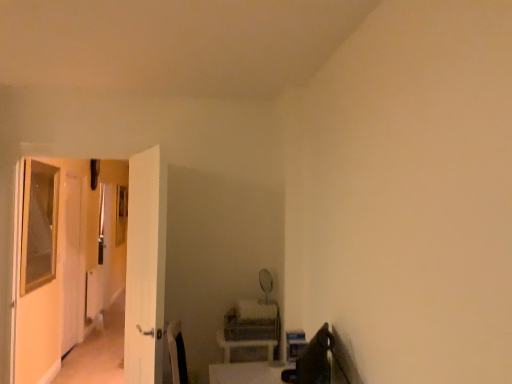
Question: Is white glossy door at left, placed as the first screen door when sorted from front to back, turned away from green fabric swivel chair at lower right?

Choices:
 (A) no
 (B) yes

Answer: (A)

Question: From the image's perspective, is white glossy door at left, marked as the 2th screen door in a left-to-right arrangement, over green fabric swivel chair at lower right?

Choices:
 (A) no
 (B) yes

Answer: (B)

Question: Considering the relative sizes of white glossy door at left, placed as the first screen door when sorted from front to back, and green fabric swivel chair at lower right in the image provided, is white glossy door at left, placed as the first screen door when sorted from front to back, shorter than green fabric swivel chair at lower right?

Choices:
 (A) yes
 (B) no

Answer: (B)

Question: Is white glossy door at left, which is the second screen door in back-to-front order, at the left side of green fabric swivel chair at lower right?

Choices:
 (A) yes
 (B) no

Answer: (A)

Question: From a real-world perspective, is white glossy door at left, which is the second screen door in back-to-front order, on top of green fabric swivel chair at lower right?

Choices:
 (A) yes
 (B) no

Answer: (A)

Question: Considering the relative sizes of white glossy door at left, placed as the first screen door when sorted from front to back, and green fabric swivel chair at lower right in the image provided, is white glossy door at left, placed as the first screen door when sorted from front to back, bigger than green fabric swivel chair at lower right?

Choices:
 (A) yes
 (B) no

Answer: (A)

Question: Is clear glass screen door at left, the 1th screen door positioned from the back, at the left side of green fabric swivel chair at lower right?

Choices:
 (A) yes
 (B) no

Answer: (A)

Question: Is clear glass screen door at left, positioned as the 2th screen door in right-to-left order, next to green fabric swivel chair at lower right?

Choices:
 (A) yes
 (B) no

Answer: (B)

Question: Can you confirm if clear glass screen door at left, which is the 2th screen door in front-to-back order, is shorter than green fabric swivel chair at lower right?

Choices:
 (A) yes
 (B) no

Answer: (B)

Question: From the image's perspective, is clear glass screen door at left, the 1th screen door positioned from the back, located beneath green fabric swivel chair at lower right?

Choices:
 (A) yes
 (B) no

Answer: (B)

Question: Is clear glass screen door at left, the 1th screen door positioned from the back, taller than green fabric swivel chair at lower right?

Choices:
 (A) no
 (B) yes

Answer: (B)

Question: From the image's perspective, is clear glass screen door at left, the 1th screen door positioned from the back, on top of green fabric swivel chair at lower right?

Choices:
 (A) yes
 (B) no

Answer: (A)

Question: Considering the relative positions of green fabric swivel chair at lower right and white glossy door at left, placed as the first screen door when sorted from front to back, in the image provided, is green fabric swivel chair at lower right in front of white glossy door at left, placed as the first screen door when sorted from front to back,?

Choices:
 (A) no
 (B) yes

Answer: (B)